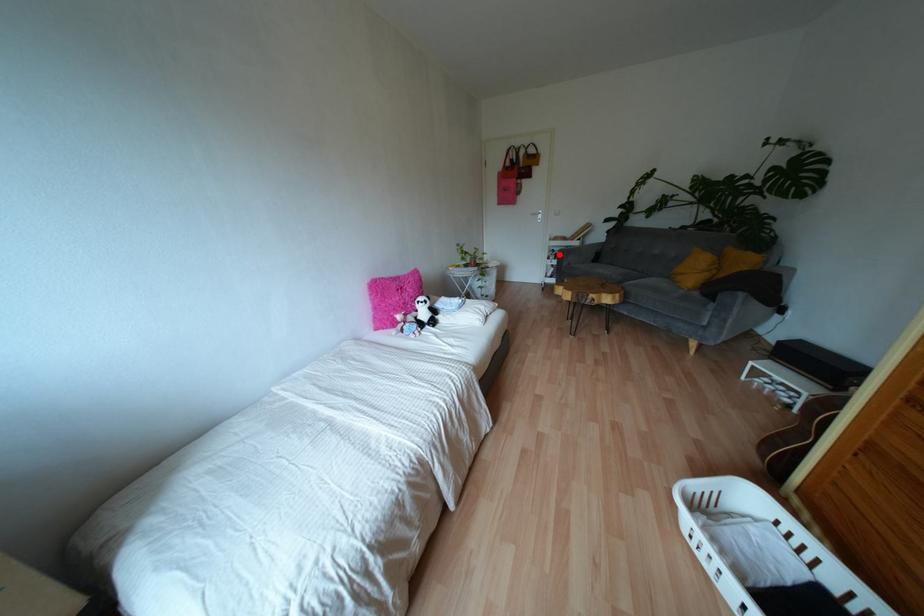
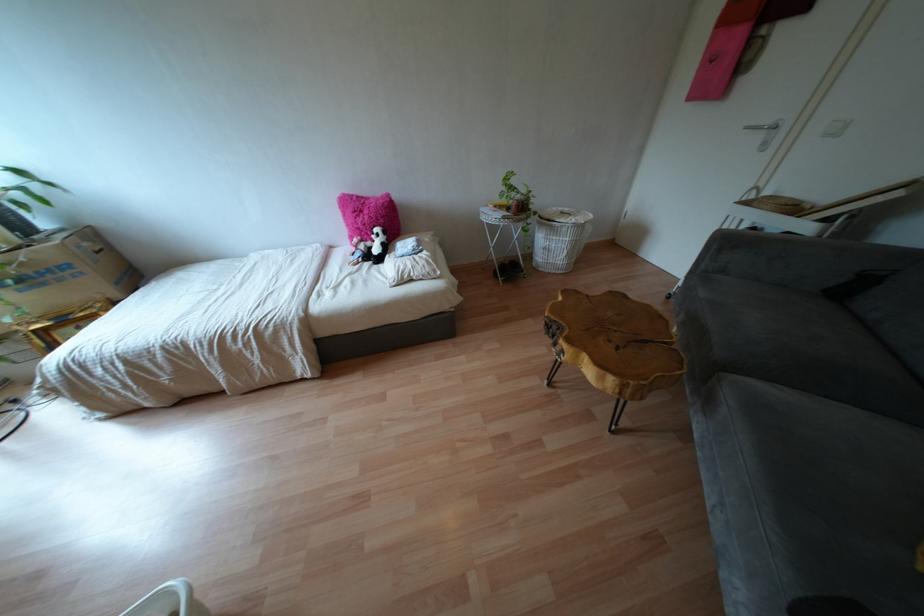
Question: I am providing you with two images of the same scene from different viewpoints. Image1 has a red point marked. In image2, the corresponding 3D location appears at what relative position? Reply with the corresponding letter.

Choices:
 (A) Closer
 (B) Farther

Answer: (B)